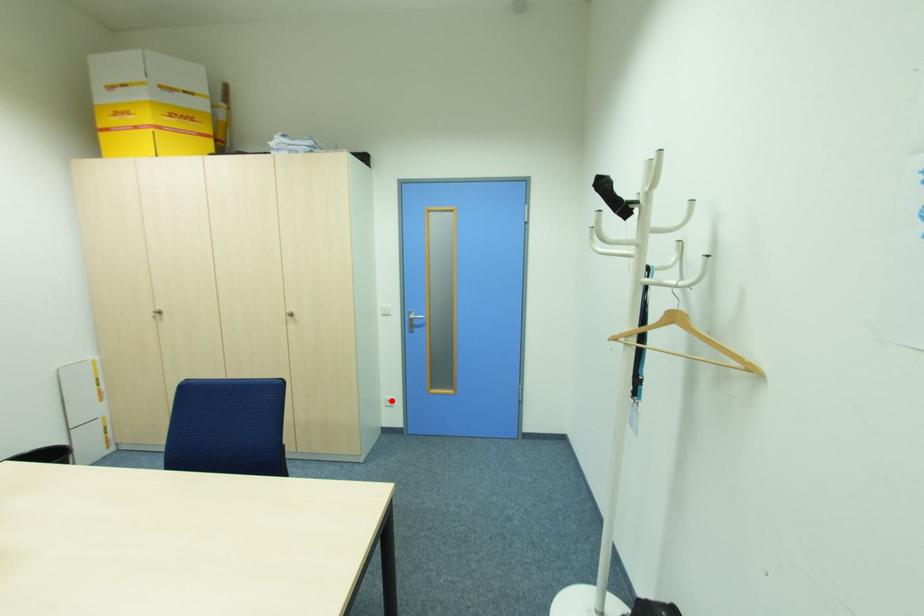
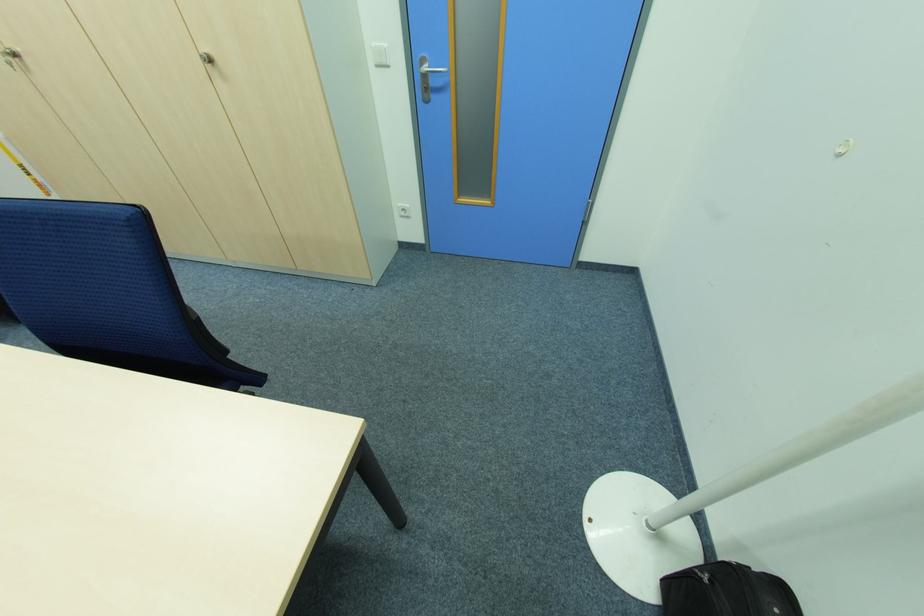
The point at the highlighted location is marked in the first image. Where is the corresponding point in the second image?

(407, 209)